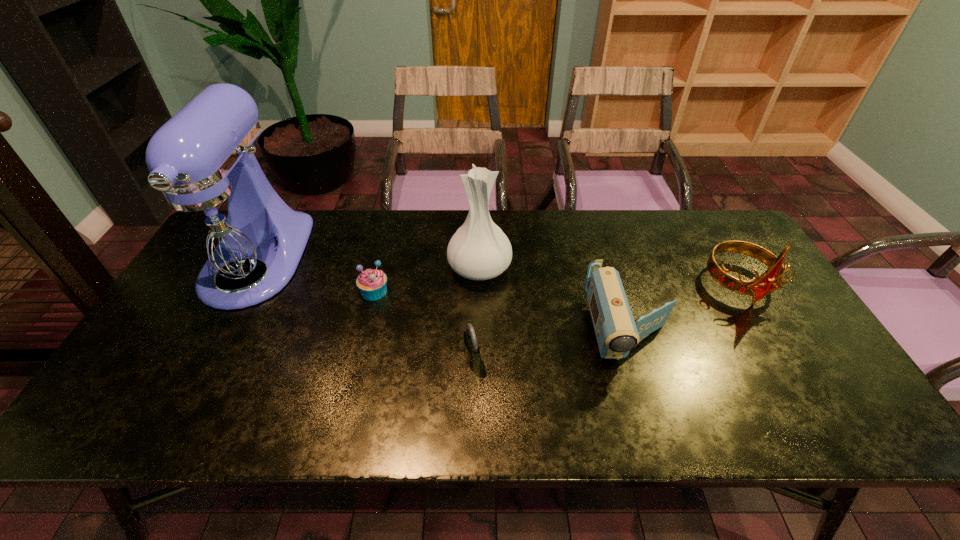
Locate an element on the screen. the leftmost object is located at coordinates (220, 225).

This screenshot has width=960, height=540. I want to click on the tallest object, so click(220, 225).

This screenshot has height=540, width=960. In order to click on the fifth shortest object in this screenshot , I will do `click(479, 250)`.

Identify the location of the fourth shortest object. The image size is (960, 540). (758, 287).

Image resolution: width=960 pixels, height=540 pixels. I want to click on tiara, so click(758, 287).

You are a GUI agent. You are given a task and a screenshot of the screen. Output one action in this format:
    pyautogui.click(x=<x>, y=<y>)
    Task: Click on the fourth tallest object
    This screenshot has width=960, height=540.
    Given the screenshot: What is the action you would take?
    pyautogui.click(x=617, y=333)

This screenshot has height=540, width=960. Find the location of `camcorder`. camcorder is located at coordinates (617, 333).

Find the location of a particular element. The height and width of the screenshot is (540, 960). the second shortest object is located at coordinates (471, 347).

Image resolution: width=960 pixels, height=540 pixels. What are the coordinates of `muffin` in the screenshot? It's located at (371, 282).

Find the location of `the fifth object from right to left`. the fifth object from right to left is located at coordinates (371, 282).